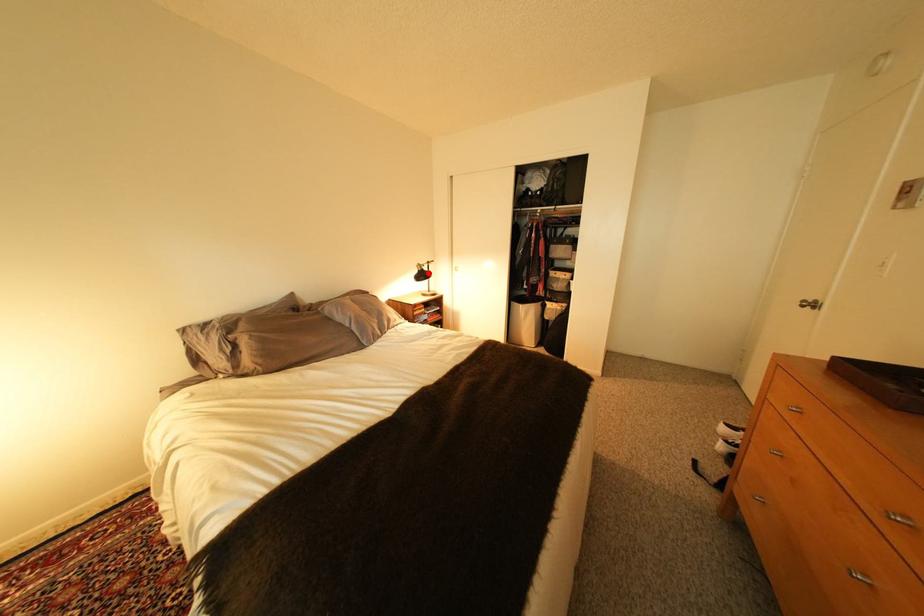
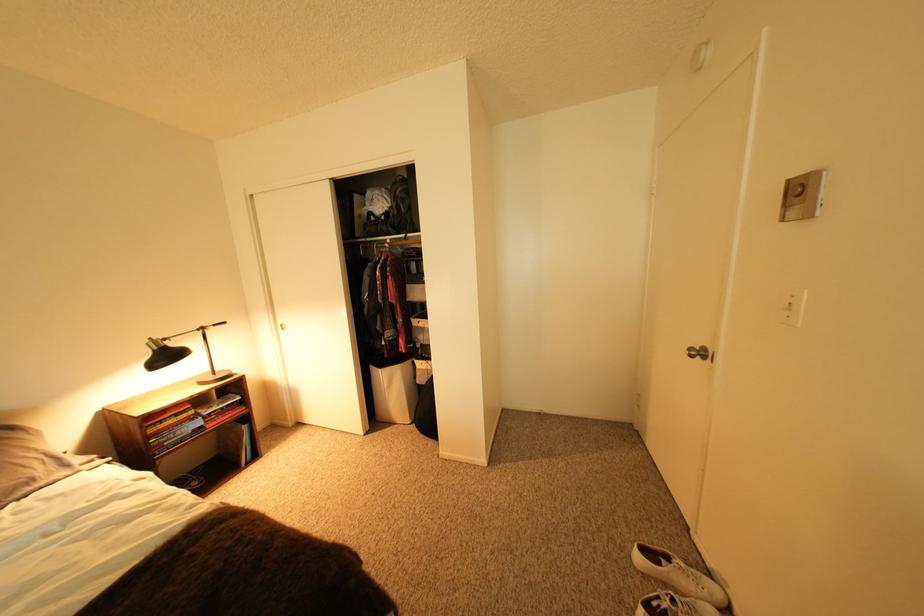
Question: I am providing you with two images of the same scene from different viewpoints. Given a red point in image1, look at the same physical point in image2. Is it:

Choices:
 (A) Closer to the viewpoint
 (B) Farther from the viewpoint

Answer: (B)